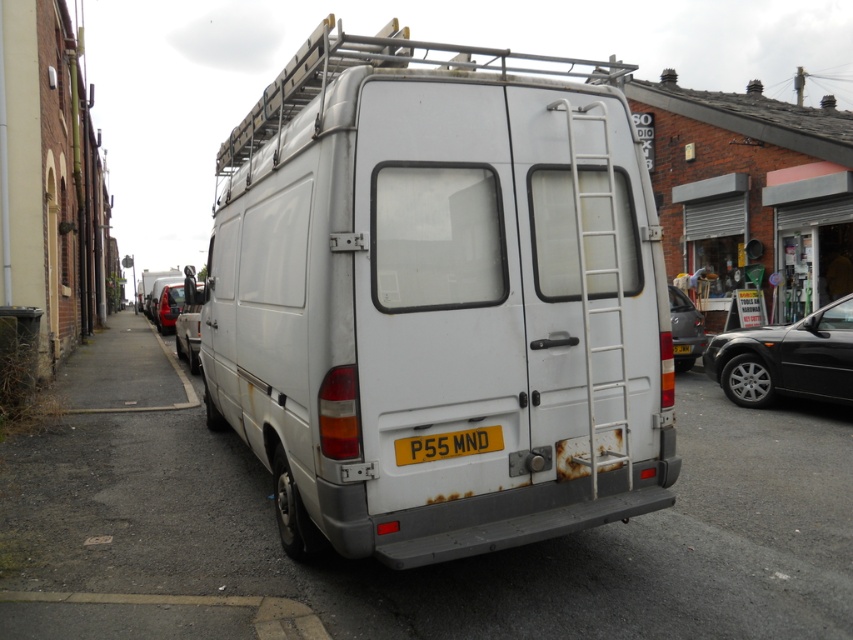
You are a delivery person who needs to park your vehicle between the shiny black sedan at right and the metallic red car at left. Based on the scene, can you safely park your car in that space?

The shiny black sedan at right is below metallic red car at left, meaning they are parked in a staggered manner. This arrangement might leave enough space between them for your vehicle, but you need to check the distance between them to ensure it is sufficient for your car.

You are a delivery driver who needs to park your vehicle in a space that is exactly the width of the asphalt at lower left. The parking space you want to enter is currently occupied by another vehicle. Once that vehicle leaves, you must decide if your truck, which is as wide as the white metal ladder at rear, can fit into the space. Can your truck fit?

The asphalt at lower left has a larger width than the white metal ladder at rear. Since your truck is as wide as the white metal ladder at rear, it will fit into the parking space as the asphalt at lower left is wider.

You are a delivery driver who needs to park your van on the street. The asphalt at lower left is cracked and the white metal ladder at rear might get damaged if not positioned correctly. Which side should you align the ladder to avoid the cracked asphalt?

The asphalt at lower left is to the left of white metal ladder at rear. To avoid the cracked asphalt at lower left, you should position the white metal ladder at rear to the right side of the vehicle so it doesn not extend over the damaged area.